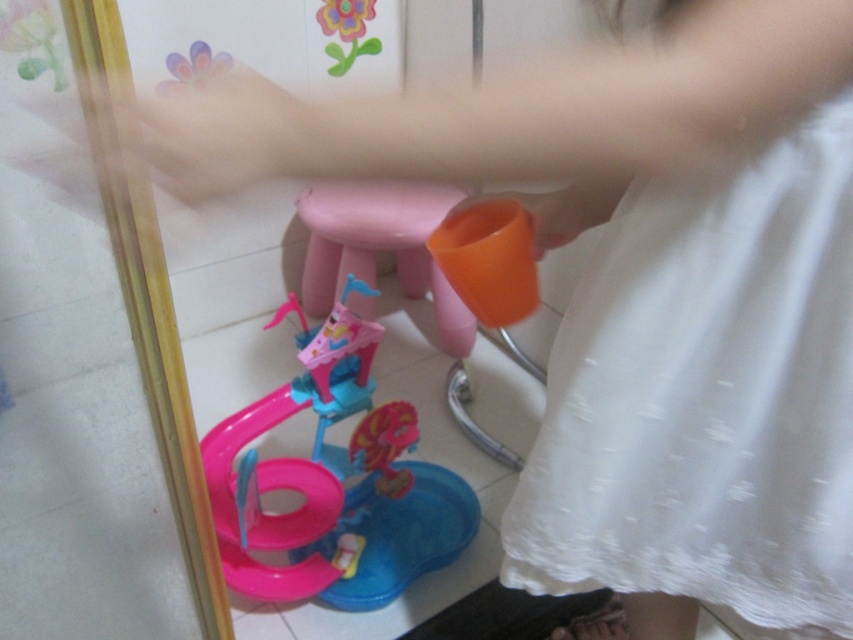
Question: Which of the following is the closest to the observer?

Choices:
 (A) pink plastic stool at center
 (B) white lace dress at lower right
 (C) pink plastic toy at lower center

Answer: (B)

Question: Does white lace dress at lower right lie behind pink plastic stool at center?

Choices:
 (A) no
 (B) yes

Answer: (A)

Question: Can you confirm if white lace dress at lower right is positioned to the right of pink plastic toy at lower center?

Choices:
 (A) yes
 (B) no

Answer: (A)

Question: Does white lace dress at lower right have a larger size compared to pink plastic toy at lower center?

Choices:
 (A) no
 (B) yes

Answer: (A)

Question: Which point is closer to the camera?

Choices:
 (A) pink plastic toy at lower center
 (B) white lace dress at lower right
 (C) pink plastic stool at center

Answer: (B)

Question: Which is farther from the pink plastic toy at lower center?

Choices:
 (A) white lace dress at lower right
 (B) pink plastic stool at center

Answer: (A)